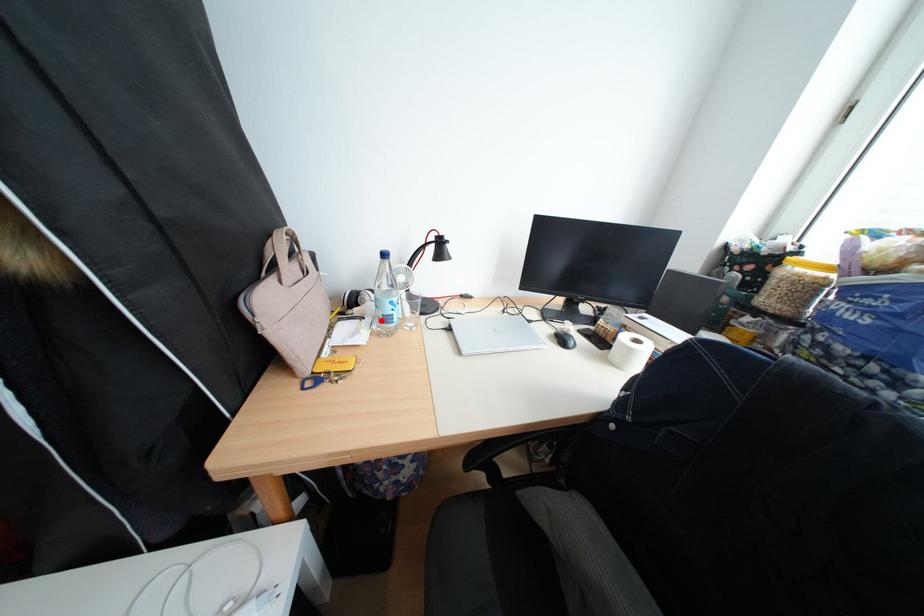
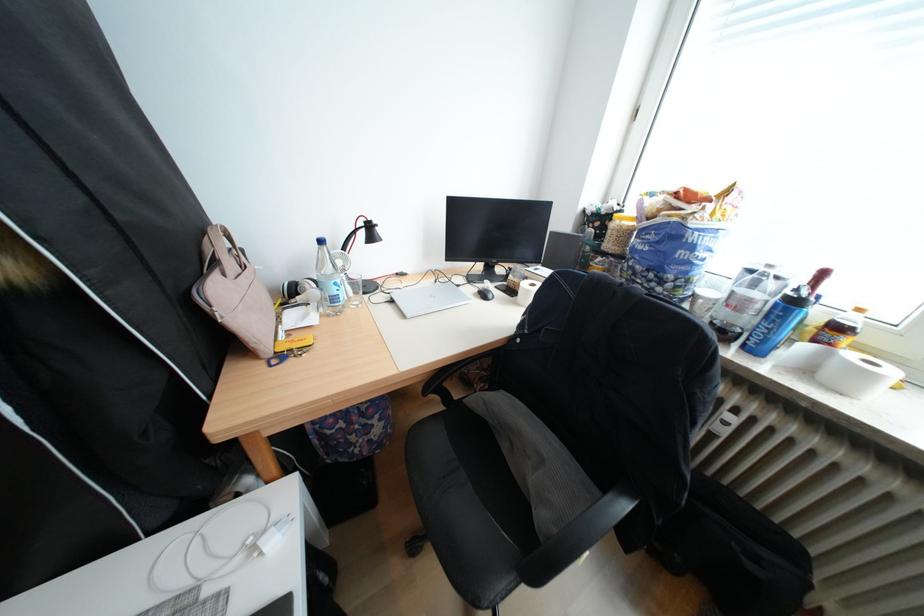
Where in the second image is the point corresponding to the highlighted location from the first image?

(325, 306)